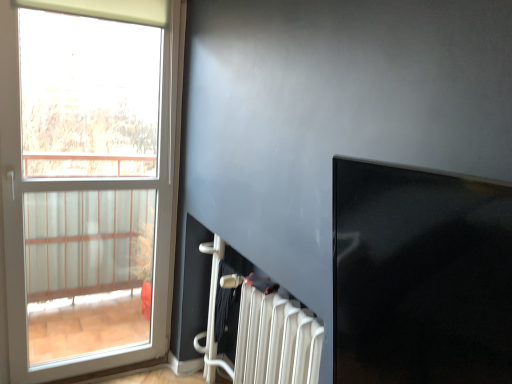
Question: Looking at their shapes, would you say white plastic radiator at lower center is wider or thinner than white glass window at left?

Choices:
 (A) thin
 (B) wide

Answer: (B)

Question: Considering the relative positions of white plastic radiator at lower center and white glass window at left in the image provided, is white plastic radiator at lower center to the left or to the right of white glass window at left?

Choices:
 (A) right
 (B) left

Answer: (A)

Question: Estimate the real-world distances between objects in this image. Which object is farther from the transparent glass window screen at upper right?

Choices:
 (A) white glass window at left
 (B) white plastic radiator at lower center

Answer: (A)

Question: Based on their relative distances, which object is farther from the white glass window at left?

Choices:
 (A) white plastic radiator at lower center
 (B) transparent glass window screen at upper right

Answer: (B)